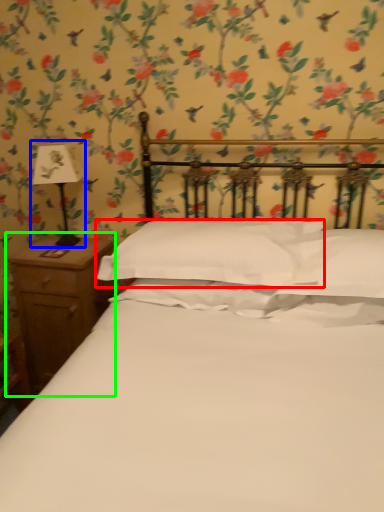
Question: Which object is the closest to the pillow (highlighted by a red box)? Choose among these: bedside lamp (highlighted by a blue box) or nightstand (highlighted by a green box).

Choices:
 (A) bedside lamp
 (B) nightstand

Answer: (B)